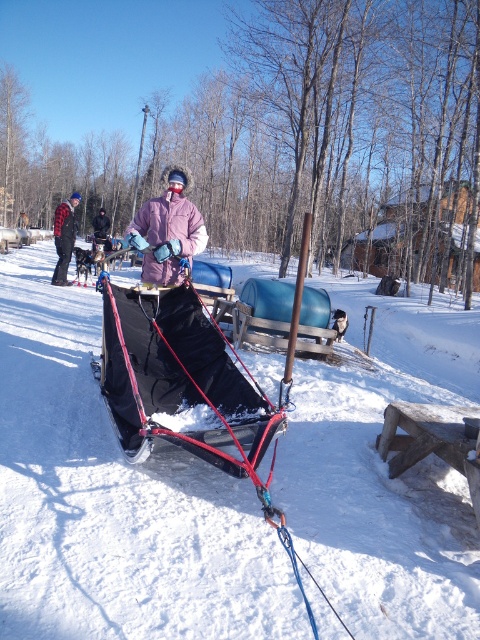
What is the coordinate of the white matte snow at center?

The white matte snow at center is located at point (112, 499).

From the picture: You are a photographer trying to capture a group photo of the two people wearing pink jackets. You notice that the pink fuzzy jacket at center and the pink fleece jacket at center are positioned differently. Which jacket should you focus on first if you want to include both in the frame without moving your camera?

The pink fleece jacket at center is to the left of the pink fuzzy jacket at center. Since the photographer wants to include both without moving the camera, focusing on the pink fleece jacket at center first ensures the leftmost subject is in frame, allowing the rightward adjustment to capture the pink fuzzy jacket at center as well.

Consider the image. You are standing in the snowy landscape and want to reach the pink fleece jacket at center. Which direction should you move to get closer to it from the brushed metal jacket at left?

Since the brushed metal jacket at left is closer to the viewer than the pink fleece jacket at center, you should move forward towards the pink fleece jacket at center to get closer to it.